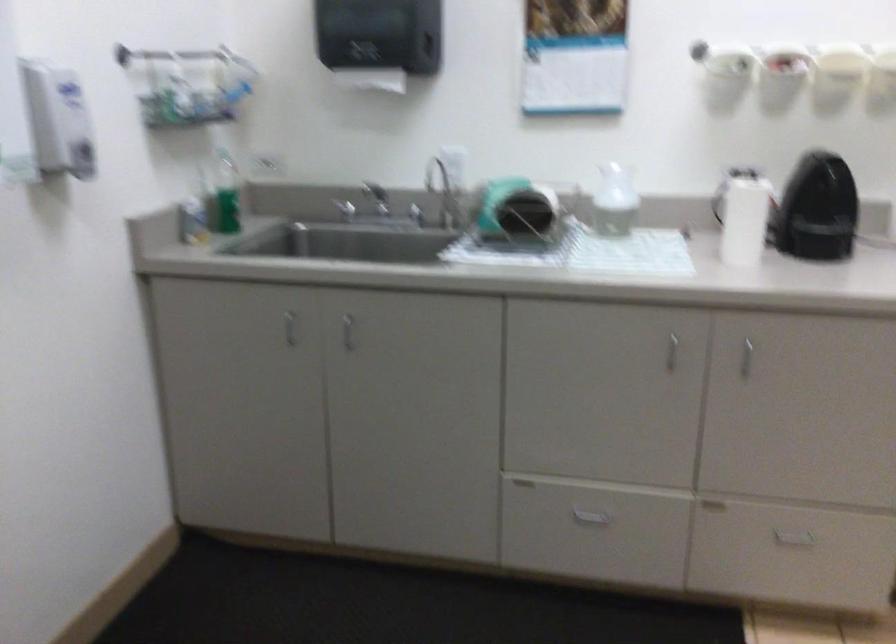
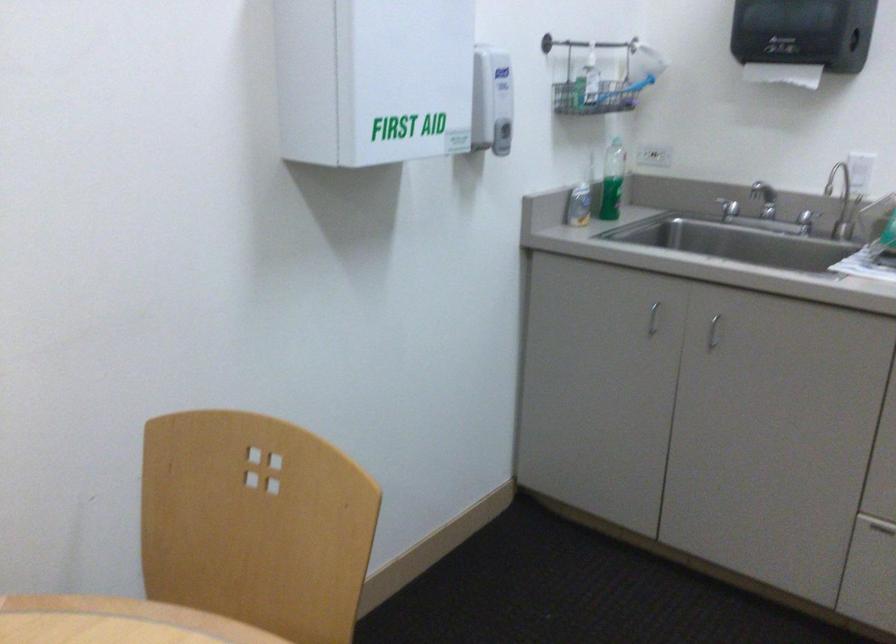
Locate, in the second image, the point that corresponds to point 365,84 in the first image.

(782, 73)